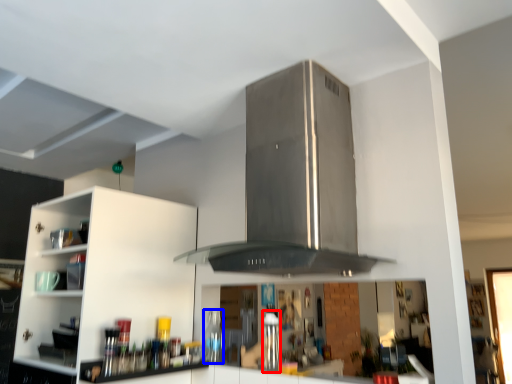
Question: Which object is closer to the camera taking this photo, appliance (highlighted by a red box) or bottle (highlighted by a blue box)?

Choices:
 (A) appliance
 (B) bottle

Answer: (A)